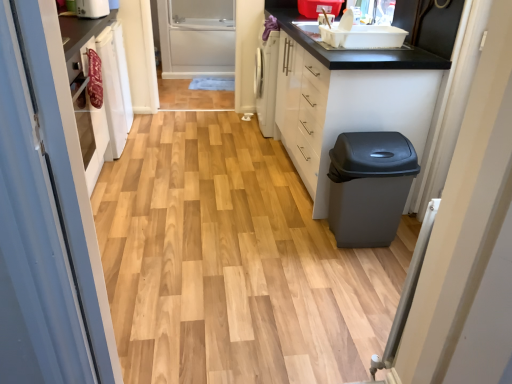
Image resolution: width=512 pixels, height=384 pixels. Find the location of `unoccupied area in front of matte gray trash can at right`. unoccupied area in front of matte gray trash can at right is located at coordinates (364, 273).